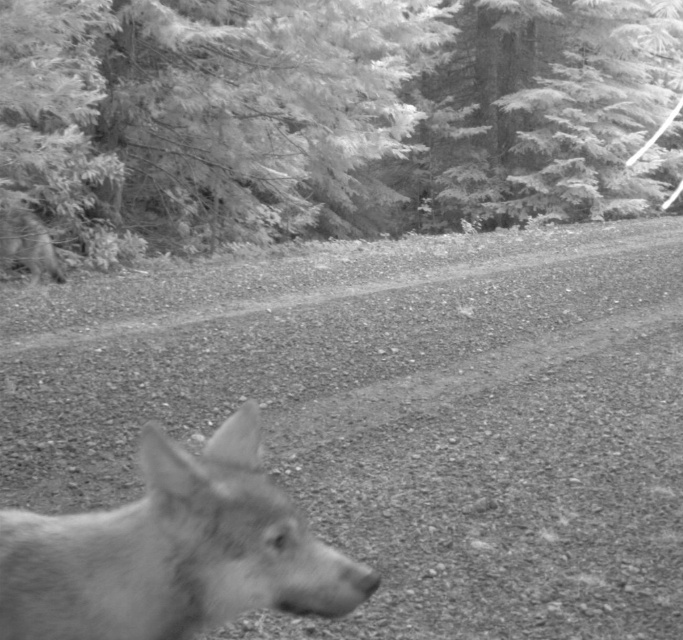
Can you confirm if coarse textured evergreen tree at upper center is taller than fuzzy fur dog at lower left?

Yes, coarse textured evergreen tree at upper center is taller than fuzzy fur dog at lower left.

Which is behind, point (520, 61) or point (182, 518)?

Point (520, 61)

Is point (31, 65) closer to viewer compared to point (14, 628)?

No, (31, 65) is behind (14, 628).

Image resolution: width=683 pixels, height=640 pixels. Identify the location of coarse textured evergreen tree at upper center. (320, 118).

Does gravelly dirt track at center appear on the right side of coarse textured evergreen tree at upper center?

In fact, gravelly dirt track at center is to the left of coarse textured evergreen tree at upper center.

Looking at this image, is gravelly dirt track at center positioned at the back of coarse textured evergreen tree at upper center?

No, it is in front of coarse textured evergreen tree at upper center.

Describe the element at coordinates (398, 416) in the screenshot. The height and width of the screenshot is (640, 683). I see `gravelly dirt track at center` at that location.

At what (x,y) coordinates should I click in order to perform the action: click on gravelly dirt track at center. Please return your answer as a coordinate pair (x, y). The height and width of the screenshot is (640, 683). Looking at the image, I should click on (398, 416).

From the picture: Does gravelly dirt track at center have a lesser width compared to fuzzy fur dog at left?

Incorrect, gravelly dirt track at center's width is not less than fuzzy fur dog at left's.

Which is more to the right, gravelly dirt track at center or fuzzy fur dog at left?

From the viewer's perspective, gravelly dirt track at center appears more on the right side.

Where is `gravelly dirt track at center`? Image resolution: width=683 pixels, height=640 pixels. gravelly dirt track at center is located at coordinates (398, 416).

I want to click on gravelly dirt track at center, so click(398, 416).